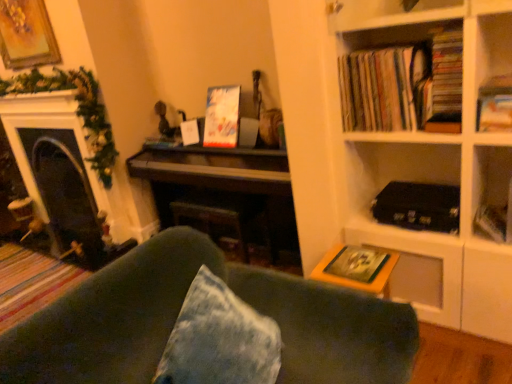
At what (x,y) coordinates should I click in order to perform the action: click on vacant area on top of hardcover book at upper right, which appears as the first book when viewed from the right (from a real-world perspective). Please return your answer as a coordinate pair (x, y). Looking at the image, I should click on (499, 82).